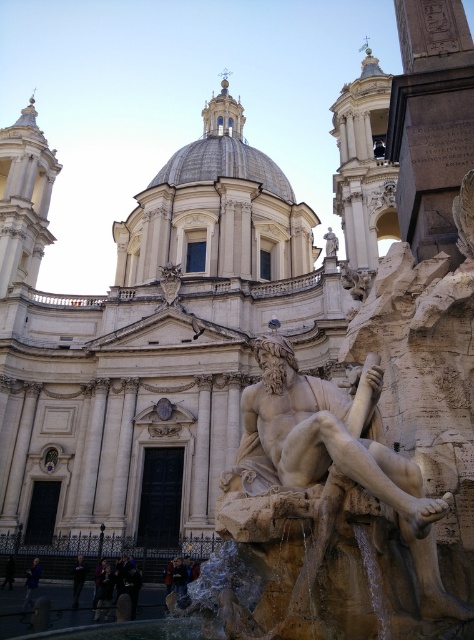
Question: Which object is closer to the camera taking this photo?

Choices:
 (A) brown stone statue at center
 (B) dark gray pants at lower left

Answer: (A)

Question: Is brown stone statue at center bigger than dark gray pants at lower left?

Choices:
 (A) yes
 (B) no

Answer: (A)

Question: Can you confirm if brown stone statue at center is smaller than dark gray pants at lower left?

Choices:
 (A) no
 (B) yes

Answer: (A)

Question: Is brown stone statue at center in front of dark gray pants at lower left?

Choices:
 (A) yes
 (B) no

Answer: (A)

Question: Which object is closer to the camera taking this photo?

Choices:
 (A) brown stone statue at center
 (B) dark gray pants at lower left

Answer: (A)

Question: Which point is closer to the camera?

Choices:
 (A) (28, 598)
 (B) (331, 513)

Answer: (B)